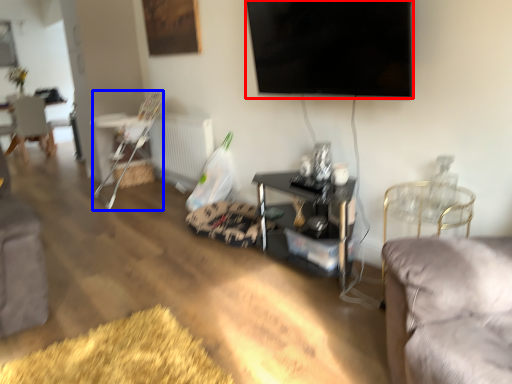
Question: Which object is further to the camera taking this photo, television (highlighted by a red box) or chair (highlighted by a blue box)?

Choices:
 (A) television
 (B) chair

Answer: (B)